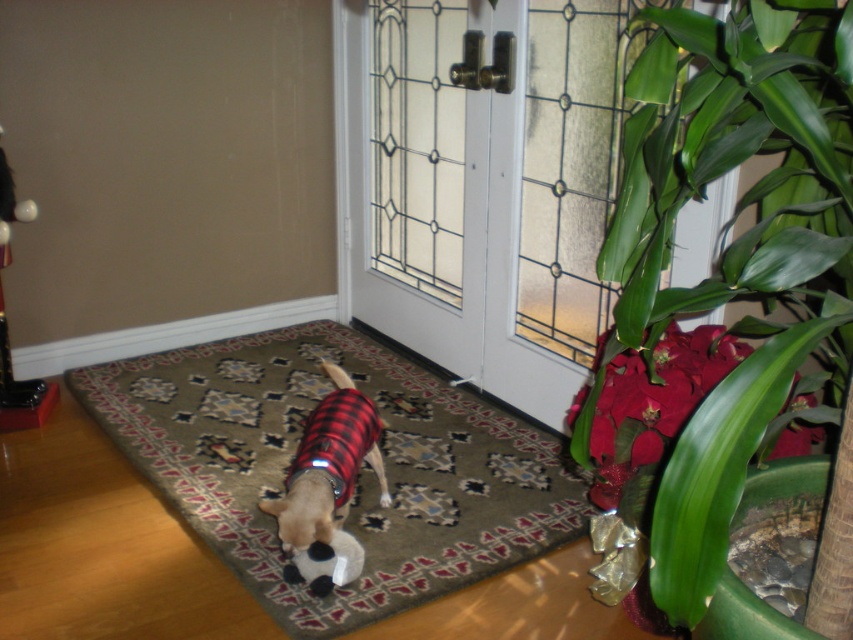
You are a photographer trying to capture the plaid fabric dog at center and the carpeted rug at center. Which object is positioned closer to the camera?

The carpeted rug at center is closer to the viewer than the plaid fabric dog at center, so it will appear closer to the camera.

You are a photographer trying to capture the plaid fabric dog at center in the image. Based on its 2D coordinates, where should you position your camera to ensure the dog is centered in your shot?

The plaid fabric dog at center is located at the 2D coordinates point (328, 486). To center the dog in your shot, position your camera so that the dog aligns with the center point of your viewfinder at those coordinates.